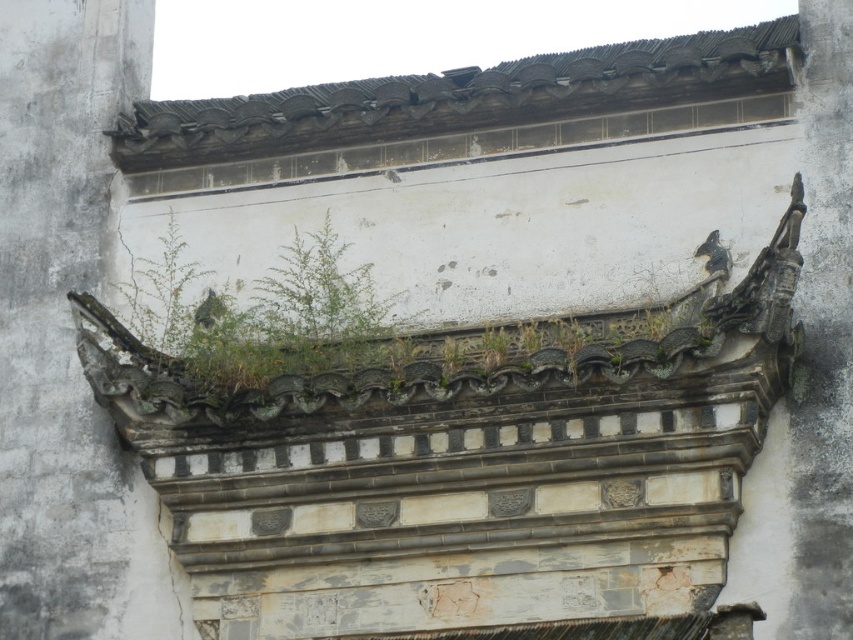
Question: Among these objects, which one is farthest from the camera?

Choices:
 (A) green leafy plant at upper left
 (B) dark gray stone dragon at upper right

Answer: (A)

Question: Which object is the farthest from the green leafy plant at upper left?

Choices:
 (A) rusty stone gargoyle at upper center
 (B) dark gray stone dragon at upper right

Answer: (B)

Question: Can you confirm if rusty stone gargoyle at upper center is bigger than green leafy plant at upper left?

Choices:
 (A) no
 (B) yes

Answer: (B)

Question: Is rusty stone gargoyle at upper center positioned behind green leafy plant at upper left?

Choices:
 (A) no
 (B) yes

Answer: (A)

Question: Can you confirm if rusty stone gargoyle at upper center is wider than dark gray stone dragon at upper right?

Choices:
 (A) yes
 (B) no

Answer: (A)

Question: Which point appears closest to the camera in this image?

Choices:
 (A) (844, 333)
 (B) (154, 336)
 (C) (3, 404)

Answer: (A)